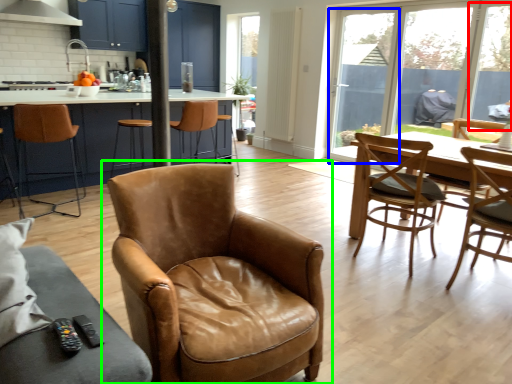
Question: Estimate the real-world distances between objects in this image. Which object is closer to window screen (highlighted by a red box), window screen (highlighted by a blue box) or chair (highlighted by a green box)?

Choices:
 (A) window screen
 (B) chair

Answer: (A)